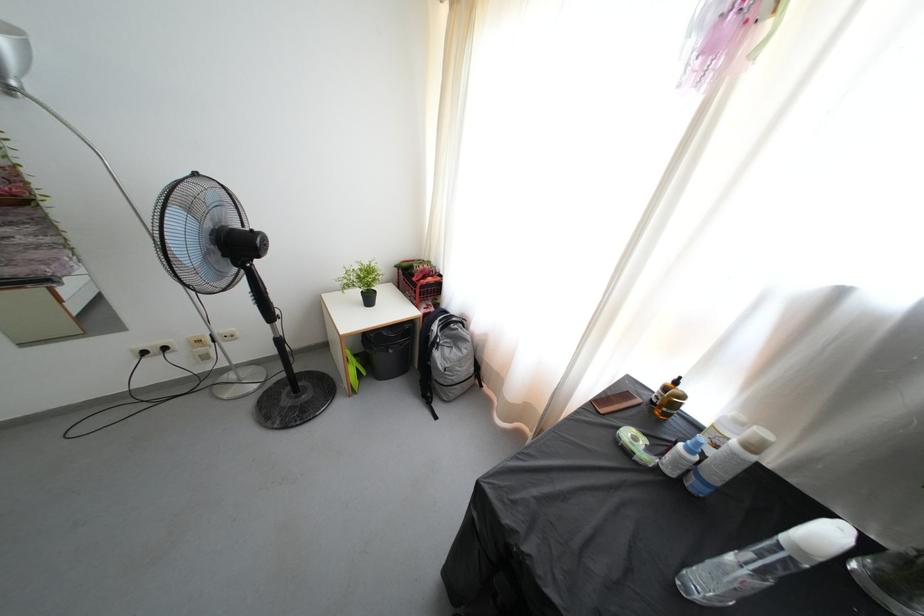
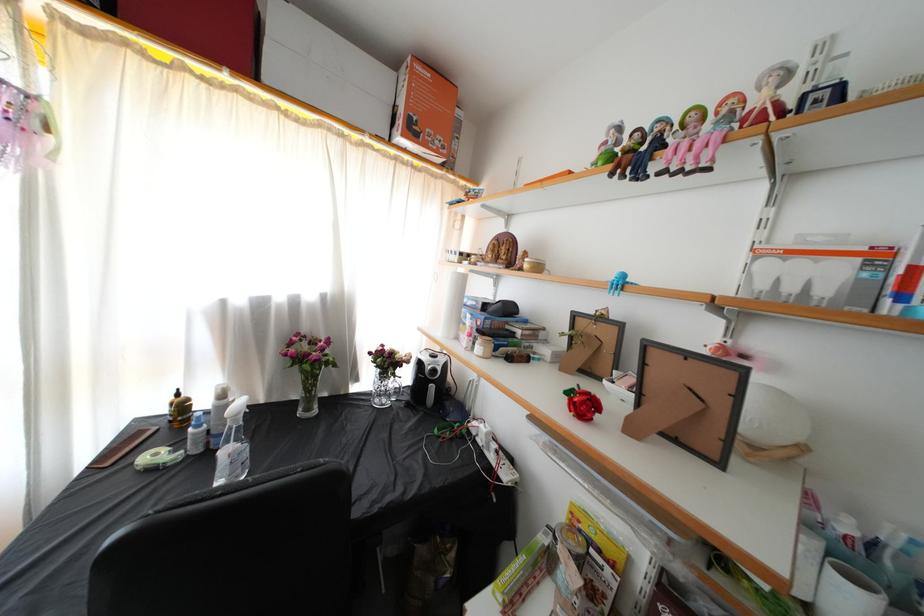
The point at (x=660, y=392) is marked in the first image. Where is the corresponding point in the second image?

(171, 416)